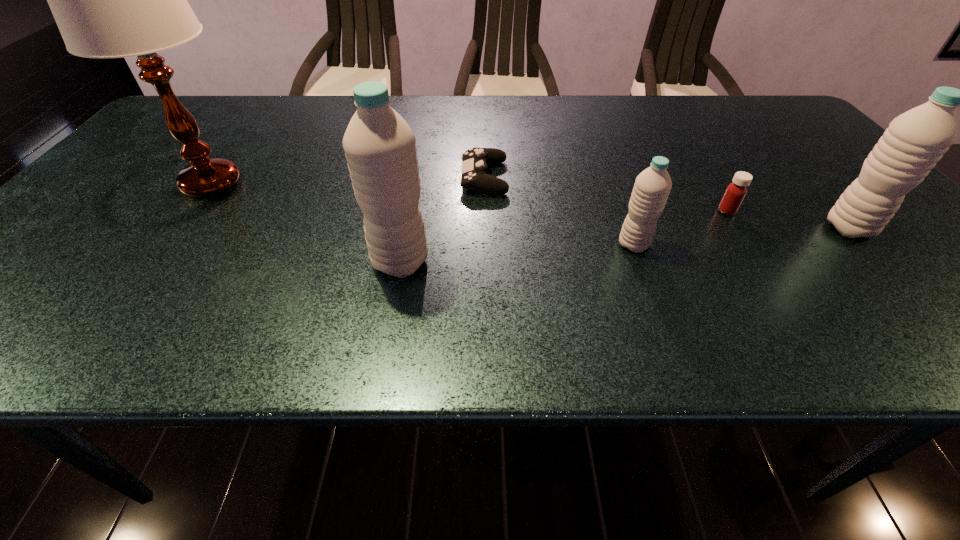
Given the evenly spaced water bottles in the image, where should an extra water bottle be added on the left to preserve the spacing? Please point to a vacant space. Please provide its 2D coordinates. Your answer should be formatted as a tuple, i.e. [(x, y)], where the tuple contains the x and y coordinates of a point satisfying the conditions above.

[(147, 281)]